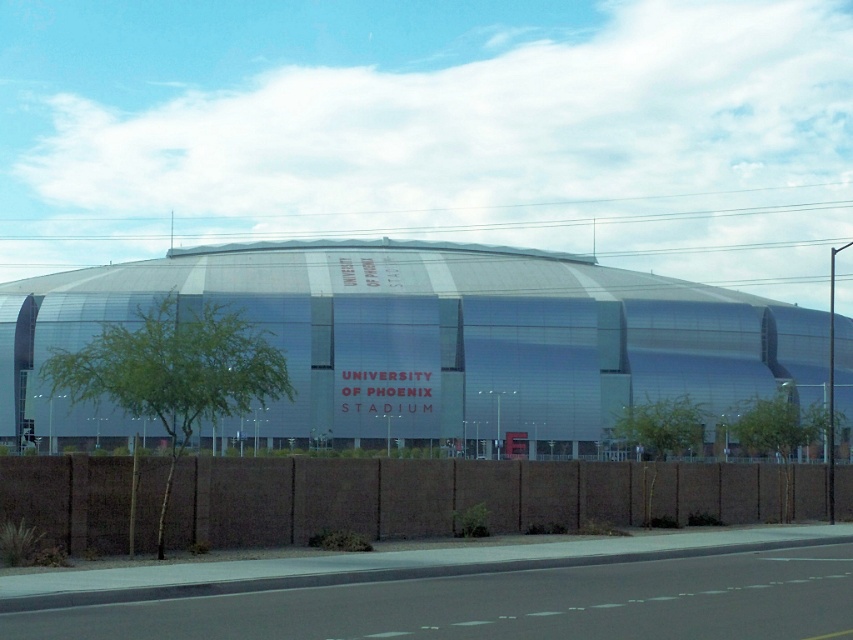
Is metallic silver stadium at center positioned at the back of brown textured fence at lower center?

No, metallic silver stadium at center is in front of brown textured fence at lower center.

Who is positioned more to the right, metallic silver stadium at center or brown textured fence at lower center?

brown textured fence at lower center is more to the right.

The height and width of the screenshot is (640, 853). What do you see at coordinates (422, 346) in the screenshot?
I see `metallic silver stadium at center` at bounding box center [422, 346].

Image resolution: width=853 pixels, height=640 pixels. Find the location of `metallic silver stadium at center`. metallic silver stadium at center is located at coordinates (422, 346).